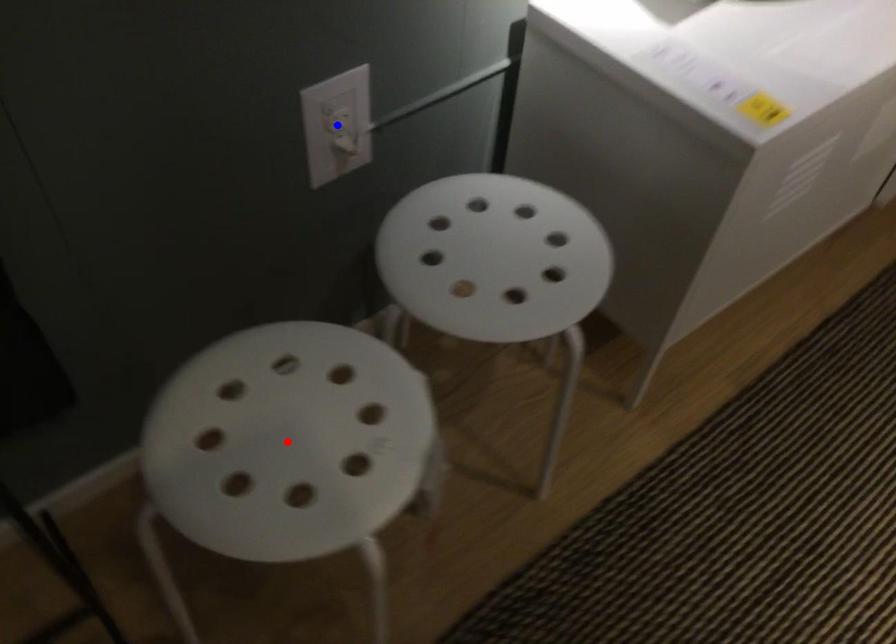
Question: Which of the two points in the image is closer to the camera?

Choices:
 (A) Blue point is closer.
 (B) Red point is closer.

Answer: (B)